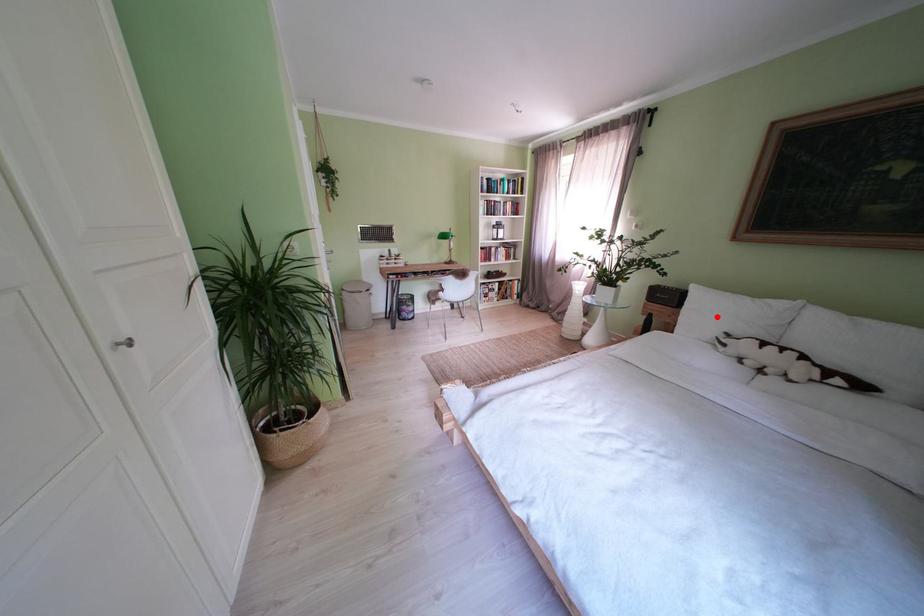
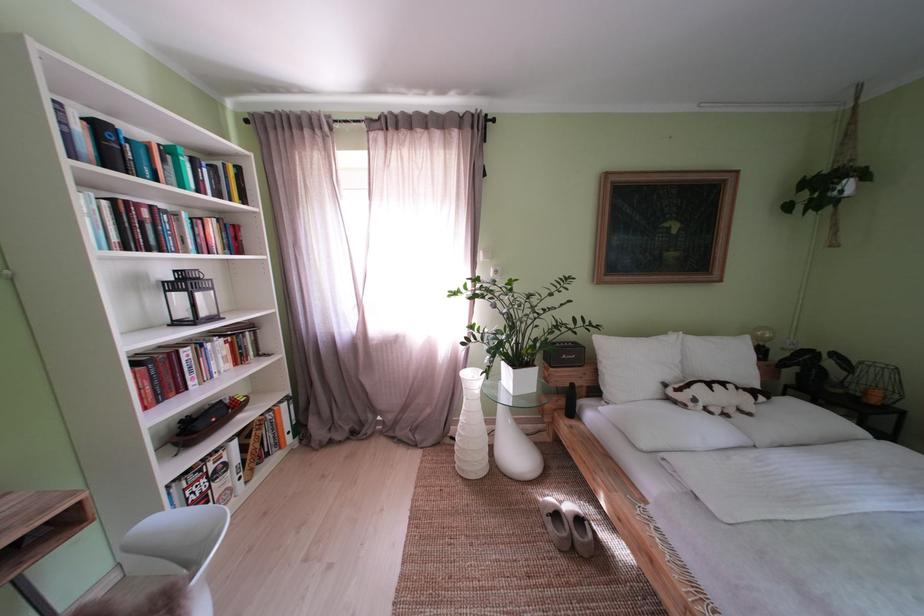
Question: I am providing you with two images of the same scene from different viewpoints. A red point is marked on the first image. Can you still see the location of the red point in image 2?

Choices:
 (A) Yes
 (B) No

Answer: (A)